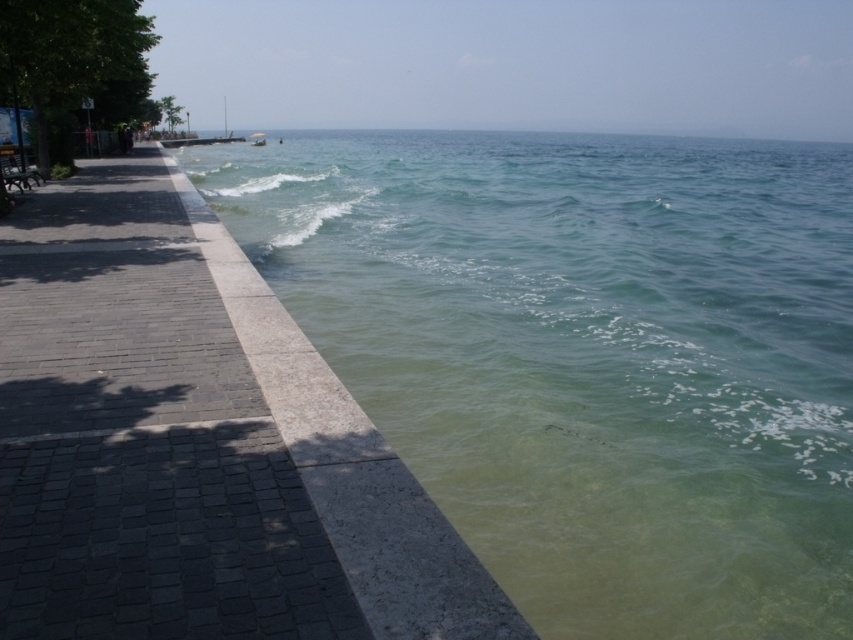
Question: Among these objects, which one is nearest to the camera?

Choices:
 (A) white plastic boat at center
 (B) dark gray stone pavement at left
 (C) clear water at lower right

Answer: (B)

Question: Is clear water at lower right to the left of dark gray stone pavement at left from the viewer's perspective?

Choices:
 (A) no
 (B) yes

Answer: (A)

Question: From the image, what is the correct spatial relationship of dark gray stone pavement at left in relation to white plastic boat at center?

Choices:
 (A) above
 (B) below

Answer: (B)

Question: Does dark gray stone pavement at left appear on the right side of white plastic boat at center?

Choices:
 (A) yes
 (B) no

Answer: (A)

Question: Which point is closer to the camera taking this photo?

Choices:
 (A) (251, 132)
 (B) (99, 500)
 (C) (804, 500)

Answer: (B)

Question: Among these objects, which one is farthest from the camera?

Choices:
 (A) clear water at lower right
 (B) white plastic boat at center

Answer: (B)